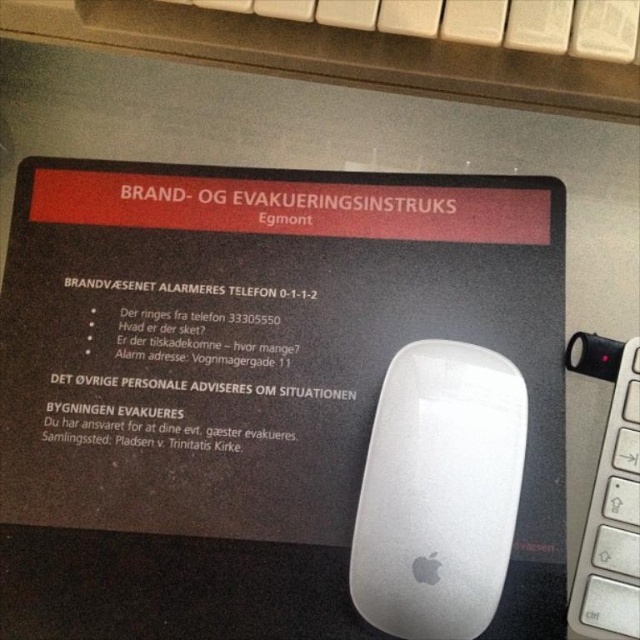
Question: Which point is closer to the camera taking this photo?

Choices:
 (A) (637, 499)
 (B) (387, 400)

Answer: (A)

Question: Does white matte mouse at center appear under white plastic keyboard at right?

Choices:
 (A) no
 (B) yes

Answer: (B)

Question: Can you confirm if white matte mouse at center is wider than white plastic keyboard at right?

Choices:
 (A) yes
 (B) no

Answer: (A)

Question: Which point appears closest to the camera in this image?

Choices:
 (A) (618, 493)
 (B) (412, 557)

Answer: (B)

Question: From the image, what is the correct spatial relationship of white matte mouse at center in relation to white plastic keyboard at right?

Choices:
 (A) left
 (B) right

Answer: (A)

Question: Which point appears closest to the camera in this image?

Choices:
 (A) (404, 588)
 (B) (588, 371)

Answer: (A)